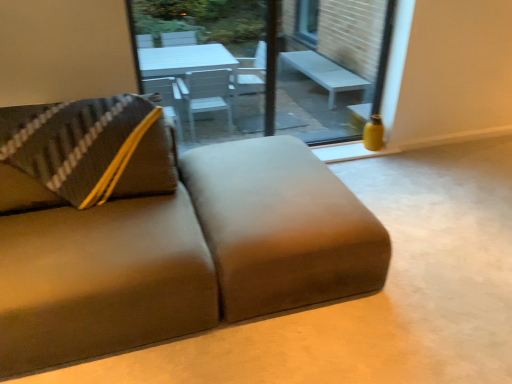
Question: Is yellow matte vase at right bigger than suede-like brown studio couch at lower left?

Choices:
 (A) no
 (B) yes

Answer: (A)

Question: Is yellow matte vase at right shorter than suede-like brown studio couch at lower left?

Choices:
 (A) no
 (B) yes

Answer: (A)

Question: Can suede-like brown studio couch at lower left be found inside yellow matte vase at right?

Choices:
 (A) no
 (B) yes

Answer: (A)

Question: From a real-world perspective, is yellow matte vase at right located higher than suede-like brown studio couch at lower left?

Choices:
 (A) yes
 (B) no

Answer: (A)

Question: Is yellow matte vase at right at the right side of suede-like brown studio couch at lower left?

Choices:
 (A) yes
 (B) no

Answer: (A)

Question: Considering the positions of matte glass window screen at center and suede-like beige footrest at lower center in the image, is matte glass window screen at center wider or thinner than suede-like beige footrest at lower center?

Choices:
 (A) wide
 (B) thin

Answer: (B)

Question: Is matte glass window screen at center bigger or smaller than suede-like beige footrest at lower center?

Choices:
 (A) small
 (B) big

Answer: (A)

Question: From a real-world perspective, relative to suede-like beige footrest at lower center, is matte glass window screen at center vertically above or below?

Choices:
 (A) above
 (B) below

Answer: (A)

Question: Is matte glass window screen at center inside or outside of suede-like beige footrest at lower center?

Choices:
 (A) inside
 (B) outside

Answer: (B)

Question: Relative to suede-like brown studio couch at lower left, is transparent glass window at center in front or behind?

Choices:
 (A) behind
 (B) front

Answer: (A)

Question: Is transparent glass window at center inside the boundaries of suede-like brown studio couch at lower left, or outside?

Choices:
 (A) outside
 (B) inside

Answer: (A)

Question: From a real-world perspective, is transparent glass window at center above or below suede-like brown studio couch at lower left?

Choices:
 (A) above
 (B) below

Answer: (A)

Question: Does point (249, 38) appear closer or farther from the camera than point (87, 334)?

Choices:
 (A) farther
 (B) closer

Answer: (A)

Question: From a real-world perspective, is suede-like brown studio couch at lower left above or below transparent glass window at center?

Choices:
 (A) below
 (B) above

Answer: (A)

Question: Do you think suede-like brown studio couch at lower left is within transparent glass window at center, or outside of it?

Choices:
 (A) inside
 (B) outside

Answer: (B)